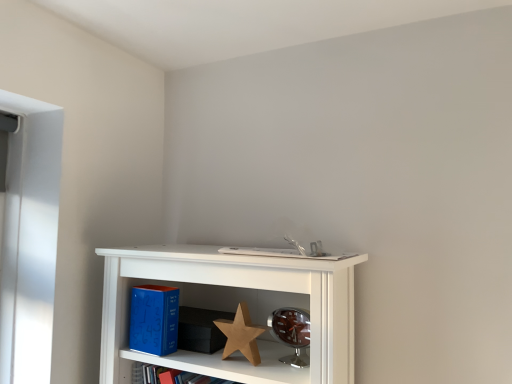
Question: Does blue matte book at lower left have a lesser height compared to wooden star at center?

Choices:
 (A) yes
 (B) no

Answer: (B)

Question: Does blue matte book at lower left have a smaller size compared to wooden star at center?

Choices:
 (A) yes
 (B) no

Answer: (B)

Question: Is blue matte book at lower left facing away from wooden star at center?

Choices:
 (A) no
 (B) yes

Answer: (A)

Question: From a real-world perspective, is blue matte book at lower left below wooden star at center?

Choices:
 (A) yes
 (B) no

Answer: (B)

Question: From a real-world perspective, does blue matte book at lower left stand above wooden star at center?

Choices:
 (A) no
 (B) yes

Answer: (B)

Question: Considering the relative positions of blue matte book at lower left and wooden star at center in the image provided, is blue matte book at lower left behind wooden star at center?

Choices:
 (A) no
 (B) yes

Answer: (B)

Question: Does white matte book at center turn towards blue matte book at lower left?

Choices:
 (A) no
 (B) yes

Answer: (A)

Question: Is white matte book at center positioned in front of blue matte book at lower left?

Choices:
 (A) no
 (B) yes

Answer: (B)

Question: Considering the relative sizes of white matte book at center and blue matte book at lower left in the image provided, is white matte book at center thinner than blue matte book at lower left?

Choices:
 (A) yes
 (B) no

Answer: (B)

Question: From the image's perspective, is white matte book at center below blue matte book at lower left?

Choices:
 (A) yes
 (B) no

Answer: (B)

Question: Can you confirm if white matte book at center is smaller than blue matte book at lower left?

Choices:
 (A) no
 (B) yes

Answer: (A)

Question: From a real-world perspective, is white matte book at center physically above blue matte book at lower left?

Choices:
 (A) no
 (B) yes

Answer: (B)

Question: From the image's perspective, does wooden star at center appear lower than white matte book at center?

Choices:
 (A) yes
 (B) no

Answer: (A)